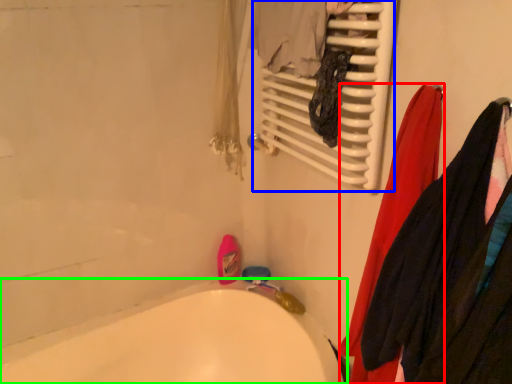
Question: Estimate the real-world distances between objects in this image. Which object is farther from clothing (highlighted by a red box), radiator (highlighted by a blue box) or bathtub (highlighted by a green box)?

Choices:
 (A) radiator
 (B) bathtub

Answer: (B)